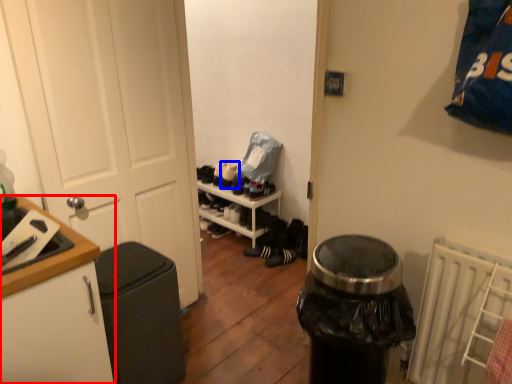
Question: Which point is further to the camera, cabinetry (highlighted by a red box) or shoe (highlighted by a blue box)?

Choices:
 (A) cabinetry
 (B) shoe

Answer: (B)